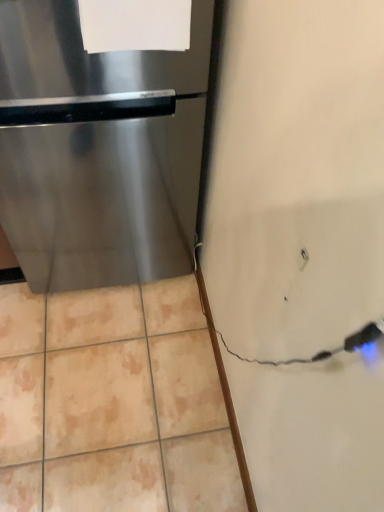
Question: Is white paper at upper center taller or shorter than stainless steel refrigerator at left?

Choices:
 (A) short
 (B) tall

Answer: (A)

Question: Is point (135, 19) closer or farther from the camera than point (145, 183)?

Choices:
 (A) farther
 (B) closer

Answer: (B)

Question: Would you say white paper at upper center is inside or outside stainless steel refrigerator at left?

Choices:
 (A) inside
 (B) outside

Answer: (A)

Question: From a real-world perspective, is stainless steel refrigerator at left positioned above or below white paper at upper center?

Choices:
 (A) below
 (B) above

Answer: (A)

Question: Based on their sizes in the image, would you say stainless steel refrigerator at left is bigger or smaller than white paper at upper center?

Choices:
 (A) small
 (B) big

Answer: (B)

Question: Which is correct: stainless steel refrigerator at left is inside white paper at upper center, or outside of it?

Choices:
 (A) inside
 (B) outside

Answer: (B)

Question: From their relative heights in the image, would you say stainless steel refrigerator at left is taller or shorter than white paper at upper center?

Choices:
 (A) tall
 (B) short

Answer: (A)